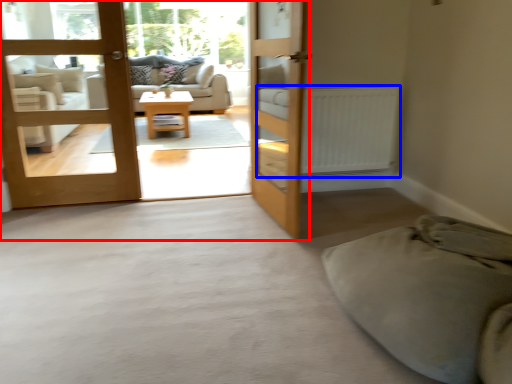
Question: Which of the following is the closest to the observer, bunk bed (highlighted by a red box) or radiator (highlighted by a blue box)?

Choices:
 (A) bunk bed
 (B) radiator

Answer: (A)